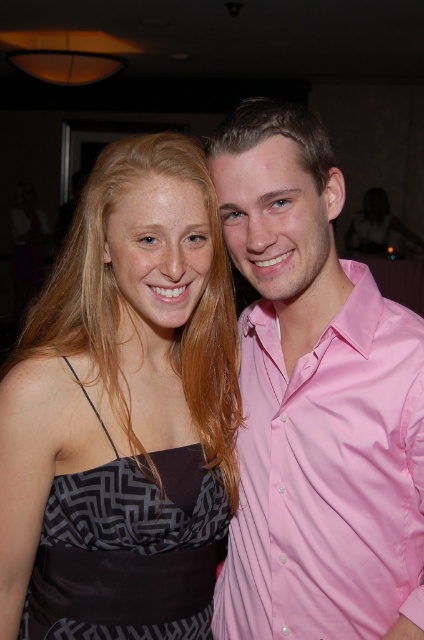
Question: Among these objects, which one is nearest to the camera?

Choices:
 (A) pink satin shirt at center
 (B) black satin dress at center

Answer: (A)

Question: Which is nearer to the black satin dress at center?

Choices:
 (A) satin dress at left
 (B) pink satin shirt at center

Answer: (A)

Question: Does pink satin shirt at center lie in front of black satin dress at center?

Choices:
 (A) yes
 (B) no

Answer: (A)

Question: Which point is closer to the camera?

Choices:
 (A) (365, 632)
 (B) (151, 452)
 (C) (78, 225)

Answer: (A)

Question: Does pink satin shirt at center appear under black satin dress at center?

Choices:
 (A) no
 (B) yes

Answer: (A)

Question: Where is satin dress at left located in relation to pink satin shirt at center in the image?

Choices:
 (A) above
 (B) below

Answer: (B)